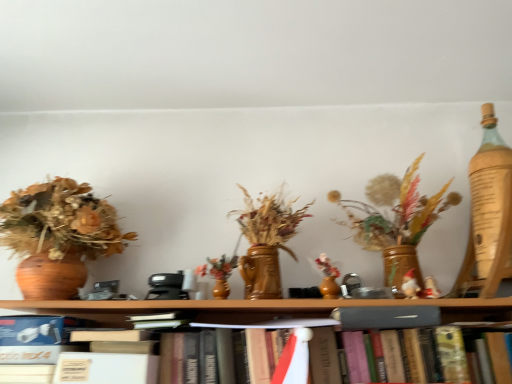
In order to face hardcover book at center, should I rotate leftwards or rightwards?

Rotate your view right by about 12.668°.

Measure the distance between hardcover book at center and camera.

A distance of 34.38 inches exists between hardcover book at center and camera.

The width and height of the screenshot is (512, 384). Describe the element at coordinates (442, 352) in the screenshot. I see `hardcover book at center` at that location.

Where is `hardcover book at center`? hardcover book at center is located at coordinates (442, 352).

Measure the distance between matte gray book at center and camera.

35.22 inches.

Describe the element at coordinates (386, 317) in the screenshot. This screenshot has height=384, width=512. I see `matte gray book at center` at that location.

Locate an element on the screen. The height and width of the screenshot is (384, 512). matte gray book at center is located at coordinates (386, 317).

This screenshot has height=384, width=512. I want to click on hardcover book at center, so click(x=442, y=352).

Is matte gray book at center at the left side of hardcover book at center?

In fact, matte gray book at center is to the right of hardcover book at center.

Which is behind, matte gray book at center or hardcover book at center?

matte gray book at center is more distant.

Considering the points (436, 310) and (257, 329), which point is behind, point (436, 310) or point (257, 329)?

The point (257, 329) is farther.

From the image's perspective, is matte gray book at center over hardcover book at center?

Yes.

From a real-world perspective, which is physically above, matte gray book at center or hardcover book at center?

matte gray book at center is physically above.

Between matte gray book at center and hardcover book at center, which one has larger width?

With larger width is hardcover book at center.

Considering the relative sizes of matte gray book at center and hardcover book at center in the image provided, is matte gray book at center taller than hardcover book at center?

No, matte gray book at center is not taller than hardcover book at center.

Between matte gray book at center and hardcover book at center, which one has smaller size?

Smaller between the two is matte gray book at center.

Is matte gray book at center not within hardcover book at center?

Actually, matte gray book at center is within hardcover book at center.

Is matte gray book at center next to hardcover book at center and touching it?

Yes, matte gray book at center is beside hardcover book at center.

Does matte gray book at center turn towards hardcover book at center?

Yes.

What's the angular difference between matte gray book at center and hardcover book at center's facing directions?

2.75 degrees.

Locate an element on the screen. book on the left of matte gray book at center is located at coordinates (442, 352).

Can you confirm if hardcover book at center is positioned to the left of matte gray book at center?

Indeed, hardcover book at center is positioned on the left side of matte gray book at center.

Considering the positions of objects hardcover book at center and matte gray book at center in the image provided, who is in front, hardcover book at center or matte gray book at center?

Positioned in front is hardcover book at center.

Which is closer, (x=445, y=370) or (x=436, y=325)?

Point (x=445, y=370)

From the image's perspective, would you say hardcover book at center is positioned over matte gray book at center?

No.

From a real-world perspective, is hardcover book at center physically located above or below matte gray book at center?

hardcover book at center is below matte gray book at center.

Can you confirm if hardcover book at center is wider than matte gray book at center?

Indeed, hardcover book at center has a greater width compared to matte gray book at center.

Which of these two, hardcover book at center or matte gray book at center, stands shorter?

With less height is matte gray book at center.

In terms of size, does hardcover book at center appear bigger or smaller than matte gray book at center?

hardcover book at center is bigger than matte gray book at center.

Is hardcover book at center not within matte gray book at center?

Absolutely, hardcover book at center is external to matte gray book at center.

Is hardcover book at center next to matte gray book at center and touching it?

Absolutely, hardcover book at center is next to and touching matte gray book at center.

Is hardcover book at center oriented away from matte gray book at center?

That's right, hardcover book at center is facing away from matte gray book at center.

In the scene shown: Can you tell me how much hardcover book at center and matte gray book at center differ in facing direction?

2.75 degrees separate the facing orientations of hardcover book at center and matte gray book at center.

The image size is (512, 384). Find the location of `paperback book above the hardcover book at center (from the image's perspective)`. paperback book above the hardcover book at center (from the image's perspective) is located at coordinates (386, 317).

This screenshot has height=384, width=512. I want to click on book below the matte gray book at center (from the image's perspective), so click(x=442, y=352).

Find the location of a particular element. This screenshot has height=384, width=512. book that is in front of the matte gray book at center is located at coordinates (442, 352).